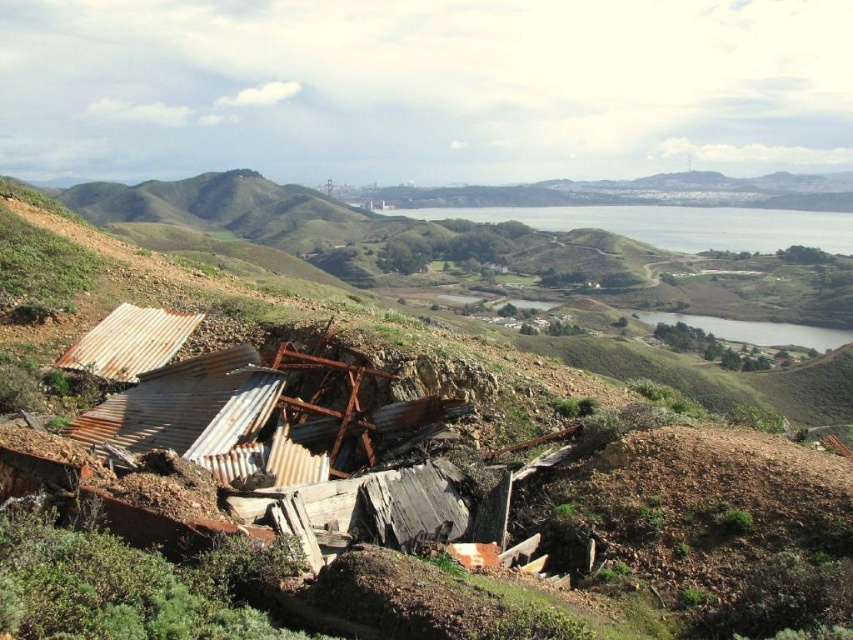
You are a surveyor examining a map of the abandoned area. You see a point labeled as point (708, 508). What does this point indicate?

The point (708, 508) marks the location of rusty corrugated metal at lower left.

You are a photographer planning to capture a wide landscape shot of the scene. Given that the rusty corrugated metal at lower left and the green grassy lake at center are both in your frame, which object will occupy more of the photo? Explain your reasoning based on their spatial relationship.

The green grassy lake at center occupies more space in the photo than the rusty corrugated metal at lower left because the description states that the rusty corrugated metal at lower left occupies less space than green grassy lake at center.

You are a surveyor measuring distances between landmarks in the image. You need to determine if the distance between the rusty corrugated metal at lower left and the green grassy lake at center is over 1000 feet. What is your conclusion?

The rusty corrugated metal at lower left and green grassy lake at center are 895.83 feet apart, so the distance is under 1000 feet.